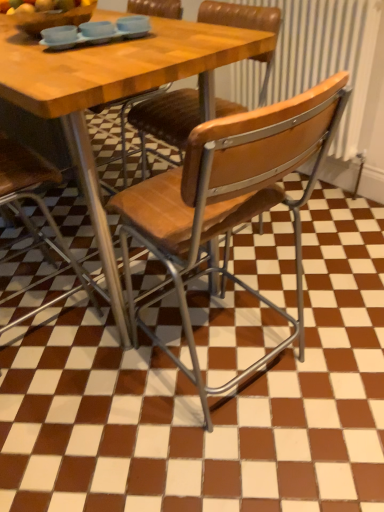
Question: Considering the positions of wooden bowl at upper left and wooden seat at center, positioned as the first chair in right-to-left order, in the image, is wooden bowl at upper left bigger or smaller than wooden seat at center, positioned as the first chair in right-to-left order,?

Choices:
 (A) small
 (B) big

Answer: (A)

Question: In terms of width, does wooden bowl at upper left look wider or thinner when compared to wooden seat at center, positioned as the first chair in right-to-left order?

Choices:
 (A) thin
 (B) wide

Answer: (A)

Question: Which is farther from the wooden seat at center, marked as the 3th chair in a right-to-left arrangement?

Choices:
 (A) matte blue tray at upper center
 (B) wooden seat at center, the third chair when ordered from left to right
 (C) wooden seat at center, which is the 2th chair in left-to-right order
 (D) wooden chair at center
 (E) wooden bowl at upper left

Answer: (A)

Question: Which is farther from the wooden bowl at upper left?

Choices:
 (A) wooden seat at center, marked as the 3th chair in a right-to-left arrangement
 (B) wooden seat at center, which is the 2th chair in left-to-right order
 (C) wooden seat at center, positioned as the first chair in right-to-left order
 (D) matte blue tray at upper center
 (E) wooden chair at center

Answer: (E)